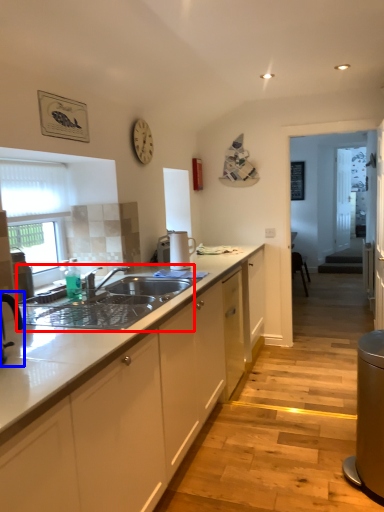
Question: Which point is closer to the camera, sink (highlighted by a red box) or tap (highlighted by a blue box)?

Choices:
 (A) sink
 (B) tap

Answer: (B)